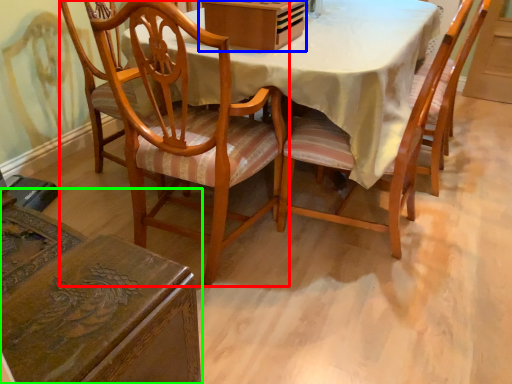
Question: Which object is positioned closest to chair (highlighted by a red box)? Select from box (highlighted by a blue box) and chair (highlighted by a green box).

Choices:
 (A) box
 (B) chair

Answer: (A)